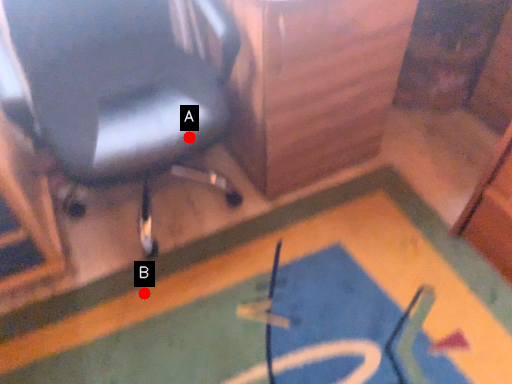
Question: Two points are circled on the image, labeled by A and B beside each circle. Which point appears closest to the camera in this image?

Choices:
 (A) A is closer
 (B) B is closer

Answer: (A)